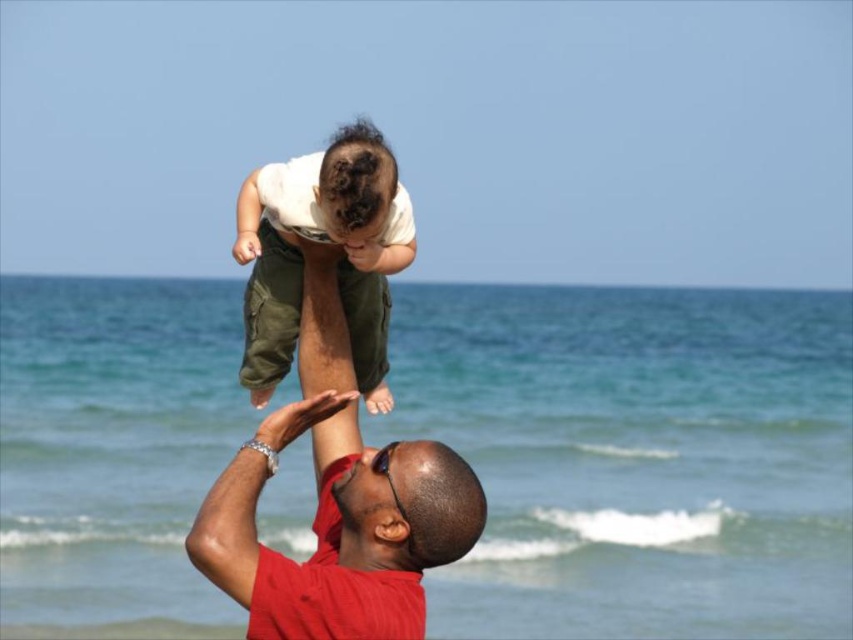
Who is positioned more to the right, matte green cargo pants at center or dark brown hair at upper center?

Positioned to the right is dark brown hair at upper center.

Can you confirm if matte green cargo pants at center is taller than dark brown hair at upper center?

Yes.

This screenshot has width=853, height=640. Identify the location of matte green cargo pants at center. (328, 241).

Between shiny black sunglasses at center and dark brown hair at upper center, which one is positioned higher?

Positioned higher is dark brown hair at upper center.

Does shiny black sunglasses at center appear on the right side of dark brown hair at upper center?

Correct, you'll find shiny black sunglasses at center to the right of dark brown hair at upper center.

Between point (379, 458) and point (345, 208), which one is positioned in front?

Point (345, 208)

This screenshot has width=853, height=640. I want to click on shiny black sunglasses at center, so click(x=408, y=508).

Is point (222, 570) positioned before point (375, 212)?

That is True.

This screenshot has width=853, height=640. What do you see at coordinates (335, 502) in the screenshot?
I see `matte red shirt at center` at bounding box center [335, 502].

Image resolution: width=853 pixels, height=640 pixels. What are the coordinates of `matte red shirt at center` in the screenshot? It's located at (335, 502).